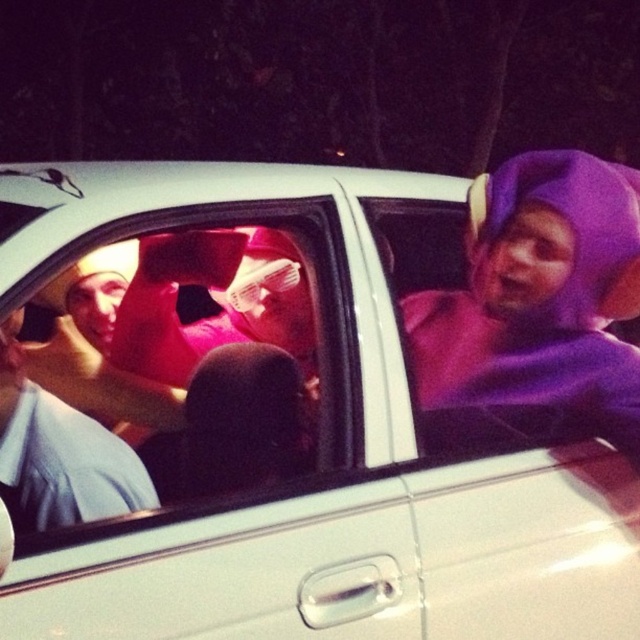
Question: Based on their relative distances, which object is farther from the transparent plastic window at center?

Choices:
 (A) purple fabric costume at center
 (B) matte blue shirt at left

Answer: (A)

Question: Is transparent plastic window at center to the right of purple fabric costume at center from the viewer's perspective?

Choices:
 (A) yes
 (B) no

Answer: (B)

Question: Considering the real-world distances, which object is closest to the transparent plastic window at center?

Choices:
 (A) matte blue shirt at left
 (B) purple fabric costume at center

Answer: (A)

Question: Considering the relative positions of transparent plastic window at center and matte blue shirt at left in the image provided, where is transparent plastic window at center located with respect to matte blue shirt at left?

Choices:
 (A) right
 (B) left

Answer: (A)

Question: Can you confirm if transparent plastic window at center is bigger than purple fabric costume at center?

Choices:
 (A) yes
 (B) no

Answer: (A)

Question: Which of the following is the farthest from the observer?

Choices:
 (A) (308, 336)
 (B) (600, 378)
 (C) (10, 474)

Answer: (A)